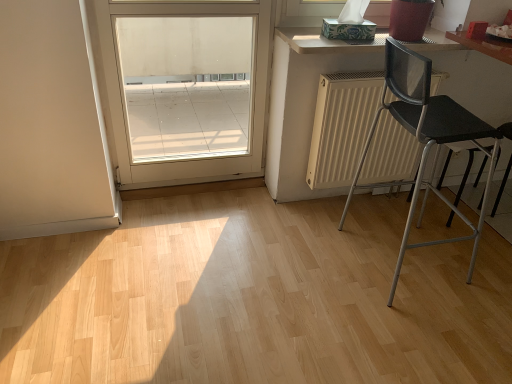
What are the coordinates of `free spot below black mesh chair at right (from a real-world perspective)` in the screenshot? It's located at (395, 259).